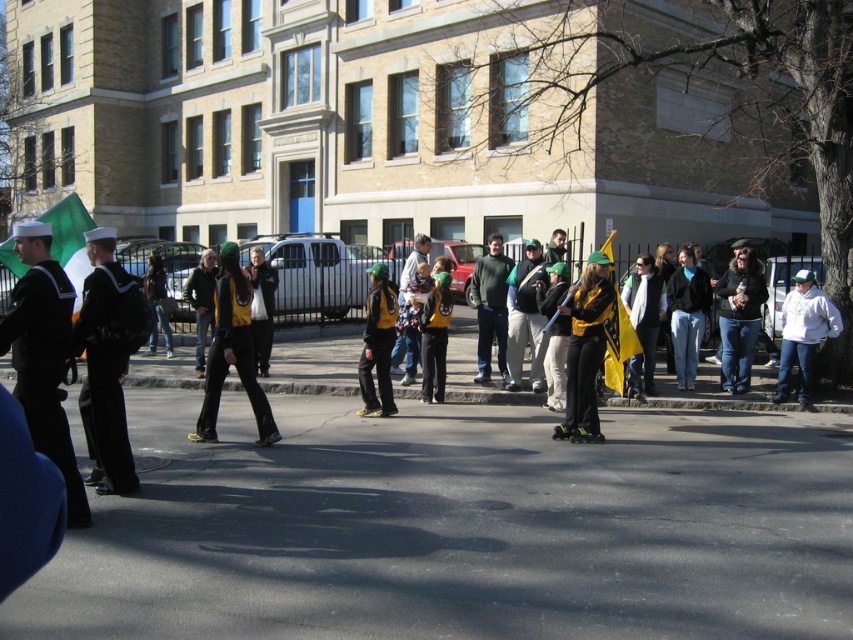
Image resolution: width=853 pixels, height=640 pixels. What do you see at coordinates (585, 344) in the screenshot?
I see `matte yellow jacket at center` at bounding box center [585, 344].

Consider the image. Can you confirm if matte yellow jacket at center is bigger than black rubber roller skate at center?

Yes.

Identify the location of matte yellow jacket at center. (585, 344).

Where is `matte yellow jacket at center`? matte yellow jacket at center is located at coordinates (585, 344).

Who is higher up, matte yellow jacket at center or white fleece jacket at right?

matte yellow jacket at center is above.

Is matte yellow jacket at center below white fleece jacket at right?

Actually, matte yellow jacket at center is above white fleece jacket at right.

Who is more forward, (596, 317) or (779, 378)?

Point (596, 317) is more forward.

Find the location of a particular element. The width and height of the screenshot is (853, 640). matte yellow jacket at center is located at coordinates pyautogui.click(x=585, y=344).

The width and height of the screenshot is (853, 640). Identify the location of white fleece jacket at right. (804, 333).

In the scene shown: Which is more to the left, white fleece jacket at right or black rubber roller skate at center?

Result: Positioned to the left is black rubber roller skate at center.

Describe the element at coordinates (804, 333) in the screenshot. I see `white fleece jacket at right` at that location.

Locate an element on the screen. Image resolution: width=853 pixels, height=640 pixels. white fleece jacket at right is located at coordinates (804, 333).